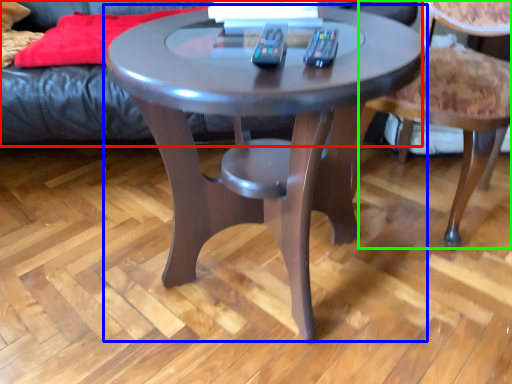
Question: Which object is the closest to the couch (highlighted by a red box)? Choose among these: coffee table (highlighted by a blue box) or chair (highlighted by a green box).

Choices:
 (A) coffee table
 (B) chair

Answer: (A)